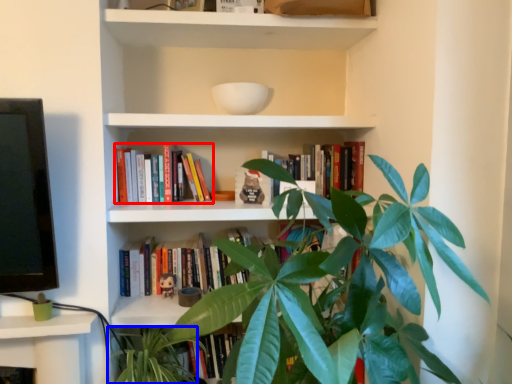
Question: Which object is closer to the camera taking this photo, book (highlighted by a red box) or vegetation (highlighted by a blue box)?

Choices:
 (A) book
 (B) vegetation

Answer: (B)